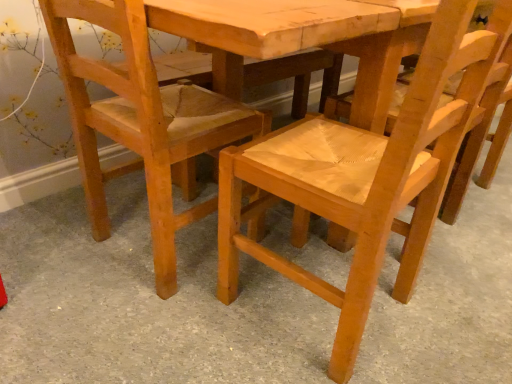
Question: Considering the relative positions of natural wood chair at center and light brown wood chair at lower left, the second chair positioned from the right, in the image provided, is natural wood chair at center to the left or to the right of light brown wood chair at lower left, the second chair positioned from the right,?

Choices:
 (A) left
 (B) right

Answer: (B)

Question: In terms of size, does natural wood chair at center appear bigger or smaller than light brown wood chair at lower left, which ranks as the 1th chair in left-to-right order?

Choices:
 (A) big
 (B) small

Answer: (A)

Question: Considering the real-world distances, which object is farthest from the natural wood chair at center?

Choices:
 (A) natural wood chair at center, the first chair from the right
 (B) light brown wood chair at lower left, the second chair positioned from the right

Answer: (B)

Question: Estimate the real-world distances between objects in this image. Which object is farther from the light brown wood chair at lower left, the second chair positioned from the right?

Choices:
 (A) natural wood chair at center, which appears as the 2th chair when viewed from the left
 (B) natural wood chair at center

Answer: (B)